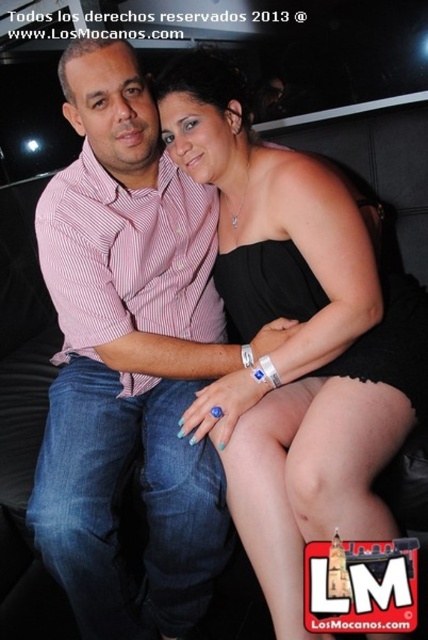
You are taking a photo of two people sitting together. The scene has a pink striped shirt at center and a black satin dress at center. Which clothing item is more to the left in the image?

The pink striped shirt at center is positioned on the left side of the black satin dress at center, so it is more to the left.

You are a photographer trying to adjust the lighting in the scene. The pink striped shirt at center is at point (x=130, y=353). Where should you position the light to ensure it illuminates the pink striped shirt at center effectively?

The pink striped shirt at center is located at point (x=130, y=353), so positioning the light directly in front of that coordinate would ensure effective illumination.